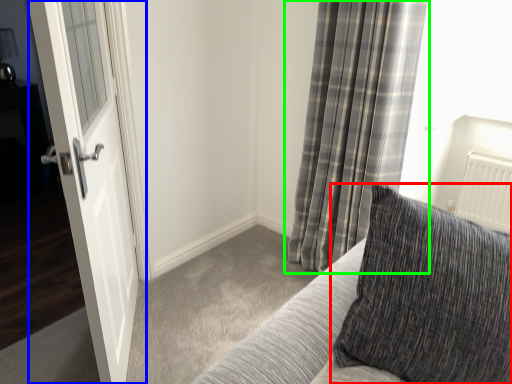
Question: Which object is the farthest from pillow (highlighted by a red box)? Choose among these: door (highlighted by a blue box) or curtain (highlighted by a green box).

Choices:
 (A) door
 (B) curtain

Answer: (B)